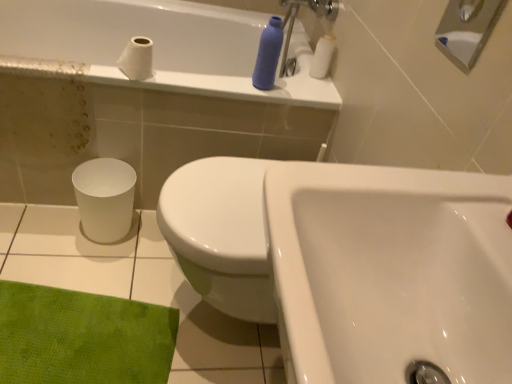
Describe the element at coordinates (322, 56) in the screenshot. I see `white matte toilet paper at upper right, the second toilet paper positioned from the front` at that location.

Locate an element on the screen. The image size is (512, 384). white ceramic tile at lower left is located at coordinates (137, 289).

Locate an element on the screen. The image size is (512, 384). matte plastic bottle at upper center is located at coordinates (268, 55).

At what (x,y) coordinates should I click in order to perform the action: click on white glossy sink at center. Please return your answer as a coordinate pair (x, y). Image resolution: width=512 pixels, height=384 pixels. Looking at the image, I should click on coord(391,271).

Find the location of a particular element. white glossy bathtub at upper center is located at coordinates (161, 46).

Identify the location of white matte toilet paper at upper left, arranged as the second toilet paper when viewed from the back. Image resolution: width=512 pixels, height=384 pixels. (137, 59).

Where is `brushed metal shower at upper right`? This screenshot has width=512, height=384. brushed metal shower at upper right is located at coordinates (466, 29).

Can you confirm if white matte toilet paper at upper right, the second toilet paper positioned from the front, is positioned to the left of white matte toilet paper at upper left, the 1th toilet paper in the left-to-right sequence?

No.

Which is more distant, (321, 37) or (144, 70)?

The point (321, 37) is behind.

Is white matte toilet paper at upper right, which is the 1th toilet paper from back to front, smaller than white matte toilet paper at upper left, the 1th toilet paper in the left-to-right sequence?

Actually, white matte toilet paper at upper right, which is the 1th toilet paper from back to front, might be larger than white matte toilet paper at upper left, the 1th toilet paper in the left-to-right sequence.

How distant is white matte toilet paper at upper right, which is the 1th toilet paper from back to front, from white matte toilet paper at upper left, the first toilet paper when ordered from front to back?

white matte toilet paper at upper right, which is the 1th toilet paper from back to front, and white matte toilet paper at upper left, the first toilet paper when ordered from front to back, are 24.77 inches apart.

Between white matte toilet paper at upper right, which is the 1th toilet paper from back to front, and matte plastic bottle at upper center, which one appears on the right side from the viewer's perspective?

From the viewer's perspective, white matte toilet paper at upper right, which is the 1th toilet paper from back to front, appears more on the right side.

From the image's perspective, between white matte toilet paper at upper right, which is the 1th toilet paper from back to front, and matte plastic bottle at upper center, which one is located above?

white matte toilet paper at upper right, which is the 1th toilet paper from back to front, appears higher in the image.

Considering the positions of point (330, 43) and point (265, 56), is point (330, 43) closer or farther from the camera than point (265, 56)?

Point (330, 43) is positioned farther from the camera compared to point (265, 56).

Can you tell me how much white matte toilet paper at upper right, which is the 1th toilet paper from back to front, and matte plastic bottle at upper center differ in facing direction?

The facing directions of white matte toilet paper at upper right, which is the 1th toilet paper from back to front, and matte plastic bottle at upper center are 0.000533 degrees apart.

Can you confirm if white ceramic tile at lower left is smaller than brushed metal shower at upper right?

No, white ceramic tile at lower left is not smaller than brushed metal shower at upper right.

Is white ceramic tile at lower left shorter than brushed metal shower at upper right?

Yes, white ceramic tile at lower left is shorter than brushed metal shower at upper right.

Is the depth of white ceramic tile at lower left less than that of brushed metal shower at upper right?

No, it is behind brushed metal shower at upper right.

Is white ceramic tile at lower left to the left of brushed metal shower at upper right from the viewer's perspective?

Indeed, white ceramic tile at lower left is positioned on the left side of brushed metal shower at upper right.

From the image's perspective, is white glossy bathtub at upper center on top of matte plastic bottle at upper center?

Actually, white glossy bathtub at upper center appears below matte plastic bottle at upper center in the image.

How different are the orientations of white glossy bathtub at upper center and matte plastic bottle at upper center in degrees?

The facing directions of white glossy bathtub at upper center and matte plastic bottle at upper center are 0.532 degrees apart.

Locate an element on the screen. The width and height of the screenshot is (512, 384). bathtub located below the matte plastic bottle at upper center (from the image's perspective) is located at coordinates (161, 46).

Does white glossy bathtub at upper center contain matte plastic bottle at upper center?

No, matte plastic bottle at upper center is located outside of white glossy bathtub at upper center.

Consider the image. How far apart are white glossy bathtub at upper center and white matte toilet paper at upper right, which is the 1th toilet paper from back to front?

white glossy bathtub at upper center is 20.69 inches from white matte toilet paper at upper right, which is the 1th toilet paper from back to front.

Considering the relative positions of white glossy bathtub at upper center and white matte toilet paper at upper right, which is the 1th toilet paper from back to front, in the image provided, is white glossy bathtub at upper center to the left or to the right of white matte toilet paper at upper right, which is the 1th toilet paper from back to front,?

In the image, white glossy bathtub at upper center appears on the left side of white matte toilet paper at upper right, which is the 1th toilet paper from back to front.

Is white glossy bathtub at upper center taller or shorter than white matte toilet paper at upper right, which is the 1th toilet paper from back to front?

white glossy bathtub at upper center is taller than white matte toilet paper at upper right, which is the 1th toilet paper from back to front.

Based on the photo, can you tell me how much white glossy bathtub at upper center and white matte toilet paper at upper right, which ranks as the 2th toilet paper in left-to-right order, differ in facing direction?

They differ by 0.532 degrees in their facing directions.

Is brushed metal shower at upper right situated inside white ceramic tile at lower left or outside?

brushed metal shower at upper right exists outside the volume of white ceramic tile at lower left.

Which is behind, brushed metal shower at upper right or white ceramic tile at lower left?

Positioned behind is white ceramic tile at lower left.

Is brushed metal shower at upper right to the right of white ceramic tile at lower left from the viewer's perspective?

Indeed, brushed metal shower at upper right is positioned on the right side of white ceramic tile at lower left.

Which of these two, brushed metal shower at upper right or white ceramic tile at lower left, is wider?

With larger width is white ceramic tile at lower left.

From a real-world perspective, who is located higher, white glossy bathtub at upper center or brushed metal shower at upper right?

In real-world perspective, brushed metal shower at upper right is above.

From the image's perspective, is white glossy bathtub at upper center located above or below brushed metal shower at upper right?

white glossy bathtub at upper center is above brushed metal shower at upper right.

How different are the orientations of white glossy bathtub at upper center and brushed metal shower at upper right in degrees?

The angle between the facing direction of white glossy bathtub at upper center and the facing direction of brushed metal shower at upper right is 90.5 degrees.

This screenshot has width=512, height=384. I want to click on shower lying below the white glossy bathtub at upper center (from the image's perspective), so click(466, 29).

This screenshot has height=384, width=512. What are the coordinates of `toilet paper in front of the white matte toilet paper at upper right, the first toilet paper viewed from the right` in the screenshot? It's located at (137, 59).

Locate an element on the screen. This screenshot has width=512, height=384. toilet paper that is the 1st one below the matte plastic bottle at upper center (from a real-world perspective) is located at coordinates (322, 56).

When comparing their distances from brushed metal shower at upper right, does white matte toilet paper at upper left, the first toilet paper when ordered from front to back, or matte plastic bottle at upper center seem further?

white matte toilet paper at upper left, the first toilet paper when ordered from front to back, lies further to brushed metal shower at upper right than the other object.

Looking at the image, which one is located further to white ceramic tile at lower left, white matte toilet paper at upper left, the first toilet paper when ordered from front to back, or white glossy sink at center?

white glossy sink at center is positioned further to the anchor white ceramic tile at lower left.

From the image, which object appears to be nearer to white glossy bathtub at upper center, white matte toilet paper at upper left, the 1th toilet paper in the left-to-right sequence, or matte plastic bottle at upper center?

matte plastic bottle at upper center.

From the image, which object appears to be farther from white glossy sink at center, white glossy bathtub at upper center or matte plastic bottle at upper center?

white glossy bathtub at upper center is further to white glossy sink at center.

Which object lies nearer to the anchor point white matte toilet paper at upper right, which is the 1th toilet paper from back to front, white glossy sink at center or white ceramic tile at lower left?

Based on the image, white ceramic tile at lower left appears to be nearer to white matte toilet paper at upper right, which is the 1th toilet paper from back to front.

When comparing their distances from white glossy sink at center, does matte plastic bottle at upper center or white ceramic tile at lower left seem closer?

white ceramic tile at lower left lies closer to white glossy sink at center than the other object.

Which object lies further to the anchor point white glossy bathtub at upper center, matte plastic bottle at upper center or white matte toilet paper at upper left, the first toilet paper when ordered from front to back?

white matte toilet paper at upper left, the first toilet paper when ordered from front to back, is further to white glossy bathtub at upper center.

Estimate the real-world distances between objects in this image. Which object is further from brushed metal shower at upper right, matte plastic bottle at upper center or white matte toilet paper at upper right, the second toilet paper positioned from the front?

Among the two, white matte toilet paper at upper right, the second toilet paper positioned from the front, is located further to brushed metal shower at upper right.

Find the location of a particular element. The width and height of the screenshot is (512, 384). toilet paper between white glossy sink at center and matte plastic bottle at upper center along the z-axis is located at coordinates (137, 59).

Where is `toiletry between white matte toilet paper at upper left, the first toilet paper when ordered from front to back, and brushed metal shower at upper right from left to right`? toiletry between white matte toilet paper at upper left, the first toilet paper when ordered from front to back, and brushed metal shower at upper right from left to right is located at coordinates (268, 55).

Locate an element on the screen. This screenshot has height=384, width=512. toilet paper between matte plastic bottle at upper center and white ceramic tile at lower left in the up-down direction is located at coordinates (137, 59).

Image resolution: width=512 pixels, height=384 pixels. Identify the location of shower located between white glossy sink at center and white matte toilet paper at upper left, marked as the 2th toilet paper in a right-to-left arrangement, in the depth direction. (466, 29).